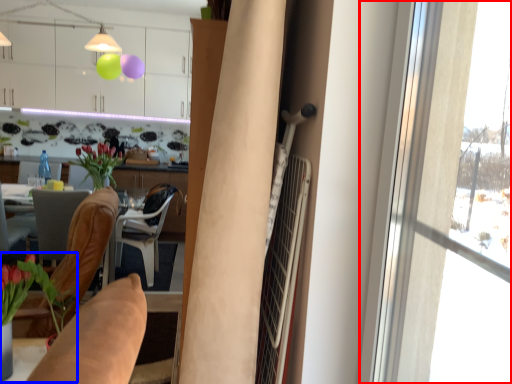
Question: Which object is closer to the camera taking this photo, window (highlighted by a red box) or houseplant (highlighted by a blue box)?

Choices:
 (A) window
 (B) houseplant

Answer: (A)